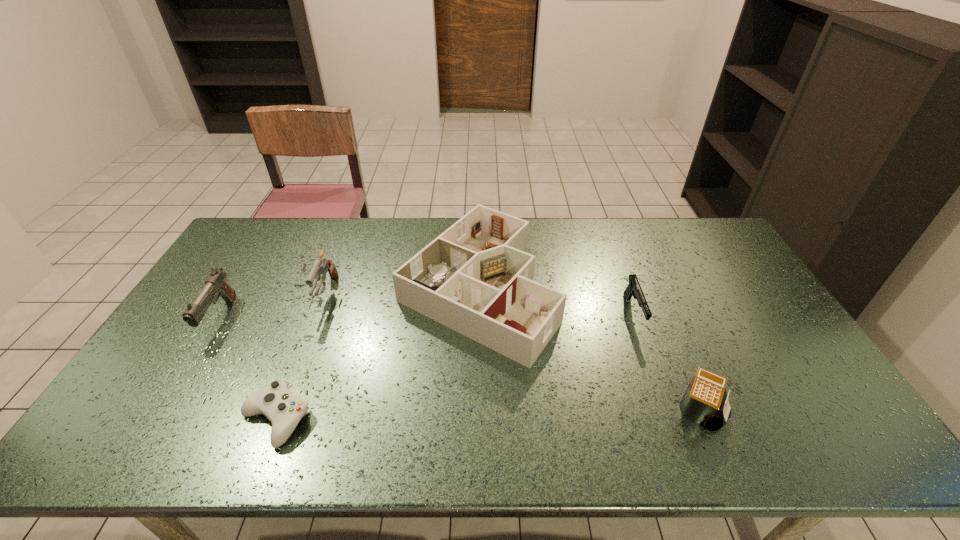
Locate an element on the screen. vacant area situated at the aiming end of the second object from right to left is located at coordinates (679, 438).

Locate an element on the screen. Image resolution: width=960 pixels, height=540 pixels. free location located on the back of the rightmost object is located at coordinates (660, 315).

Identify the location of free region located 0.210m on the left of the shortest object. (155, 419).

At what (x,y) coordinates should I click in order to perform the action: click on object located at the far edge. Please return your answer as a coordinate pair (x, y). The width and height of the screenshot is (960, 540). Looking at the image, I should click on (475, 278).

I want to click on calculator at the near edge, so click(703, 402).

Find the location of a particular element. Image resolution: width=960 pixels, height=540 pixels. control situated at the near edge is located at coordinates (275, 401).

Locate an element on the screen. object at the left edge is located at coordinates (216, 285).

This screenshot has width=960, height=540. Find the location of `free space at the far edge of the desktop`. free space at the far edge of the desktop is located at coordinates (542, 245).

Where is `vacant space at the left edge of the desktop`? vacant space at the left edge of the desktop is located at coordinates (197, 342).

I want to click on free space at the right edge of the desktop, so click(x=805, y=372).